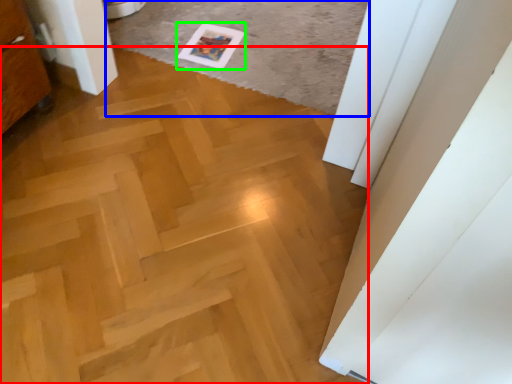
Question: Which is nearer to the plywood (highlighted by a red box)? plain (highlighted by a blue box) or postcard (highlighted by a green box).

Choices:
 (A) plain
 (B) postcard

Answer: (A)